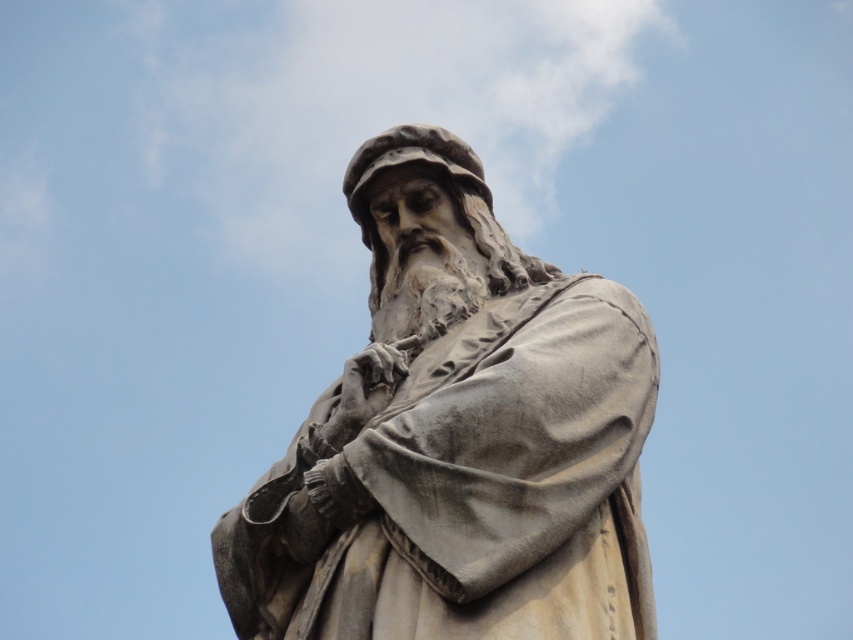
Between gray stone statue at center and white fluffy cloud at upper center, which one is positioned higher?

white fluffy cloud at upper center is above.

Who is positioned more to the left, gray stone statue at center or white fluffy cloud at upper center?

From the viewer's perspective, white fluffy cloud at upper center appears more on the left side.

Between point (531, 259) and point (216, 104), which one is positioned behind?

Point (216, 104)

Find the location of `gray stone statue at center`. gray stone statue at center is located at coordinates (456, 436).